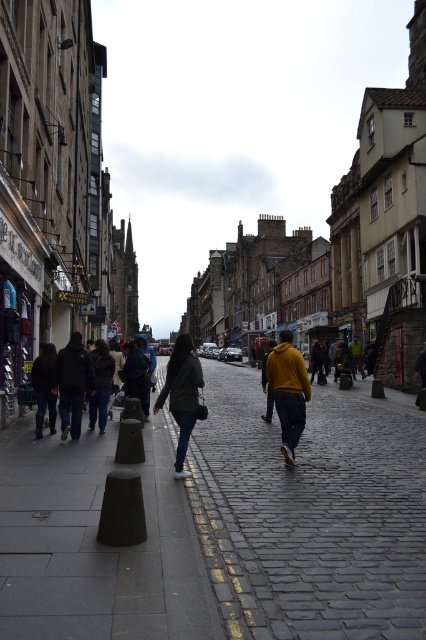
Is dark gray fabric jacket at lower left to the left of dark gray jacket at lower left from the viewer's perspective?

In fact, dark gray fabric jacket at lower left is to the right of dark gray jacket at lower left.

Does dark gray fabric jacket at lower left have a lesser width compared to dark gray jacket at lower left?

In fact, dark gray fabric jacket at lower left might be wider than dark gray jacket at lower left.

Identify the location of dark gray fabric jacket at lower left. This screenshot has width=426, height=640. (72, 381).

Can you confirm if matte yellow hoodie at center is positioned to the right of dark gray hoodie at left?

Correct, you'll find matte yellow hoodie at center to the right of dark gray hoodie at left.

You are a GUI agent. You are given a task and a screenshot of the screen. Output one action in this format:
    pyautogui.click(x=<x>, y=<y>)
    Task: Click on the matte yellow hoodie at center
    This screenshot has width=426, height=640.
    Given the screenshot: What is the action you would take?
    pyautogui.click(x=288, y=392)

The height and width of the screenshot is (640, 426). Identify the location of matte yellow hoodie at center. (288, 392).

Is point (63, 380) behind point (60, 397)?

No, it is not.

Between point (48, 385) and point (74, 365), which one is positioned in front?

Point (74, 365) is more forward.

The image size is (426, 640). What are the coordinates of `dark gray fabric jacket at lower left` in the screenshot? It's located at (72, 381).